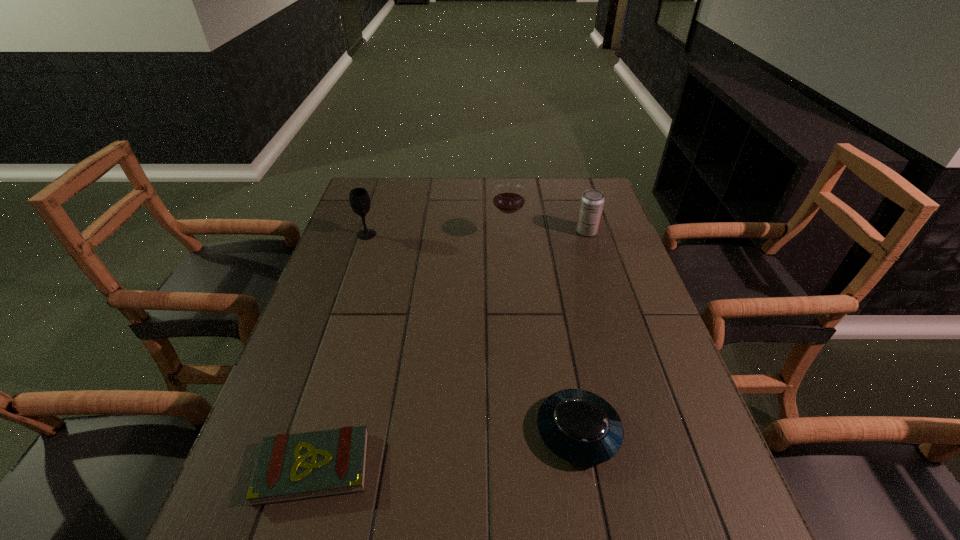
The height and width of the screenshot is (540, 960). In order to click on unoccupied position between the rightmost object and the saucer in this screenshot , I will do `click(583, 331)`.

Identify the location of free spot between the left wineglass and the rightmost object. The width and height of the screenshot is (960, 540). (477, 233).

Where is `free space between the left wineglass and the saucer`? Image resolution: width=960 pixels, height=540 pixels. free space between the left wineglass and the saucer is located at coordinates (472, 333).

The height and width of the screenshot is (540, 960). Find the location of `vacant area that lies between the saucer and the rightmost object`. vacant area that lies between the saucer and the rightmost object is located at coordinates (583, 331).

Locate an element on the screen. vacant space that's between the soda and the second shortest object is located at coordinates (583, 331).

You are a GUI agent. You are given a task and a screenshot of the screen. Output one action in this format:
    pyautogui.click(x=<x>, y=<y>)
    Task: Click on the free spot between the book and the left wineglass
    The image size is (960, 540).
    Given the screenshot: What is the action you would take?
    pyautogui.click(x=340, y=350)

I want to click on free space between the left wineglass and the book, so click(340, 350).

I want to click on empty space that is in between the right wineglass and the soda, so click(547, 234).

This screenshot has height=540, width=960. Find the location of `object that is the closest to the left wineglass`. object that is the closest to the left wineglass is located at coordinates (508, 198).

Identify which object is the third nearest to the right wineglass. Please provide its 2D coordinates. Your answer should be formatted as a tuple, i.e. [(x, y)], where the tuple contains the x and y coordinates of a point satisfying the conditions above.

[(578, 426)]